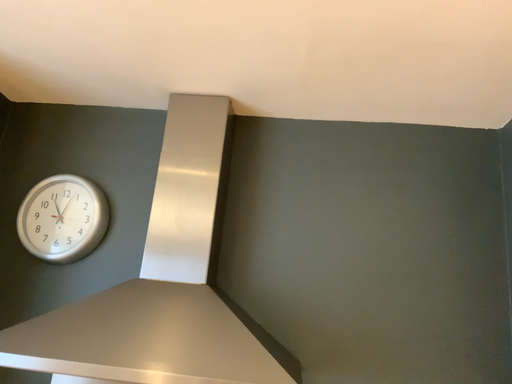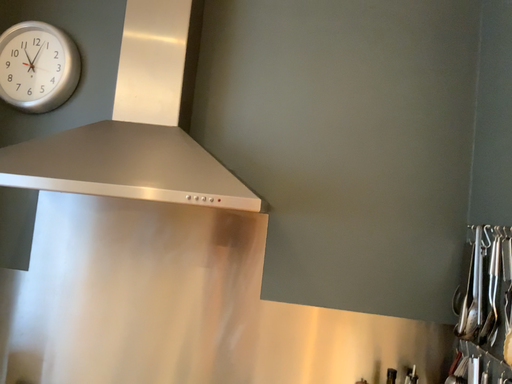
Question: How did the camera likely rotate when shooting the video?

Choices:
 (A) rotated downward
 (B) rotated upward

Answer: (A)